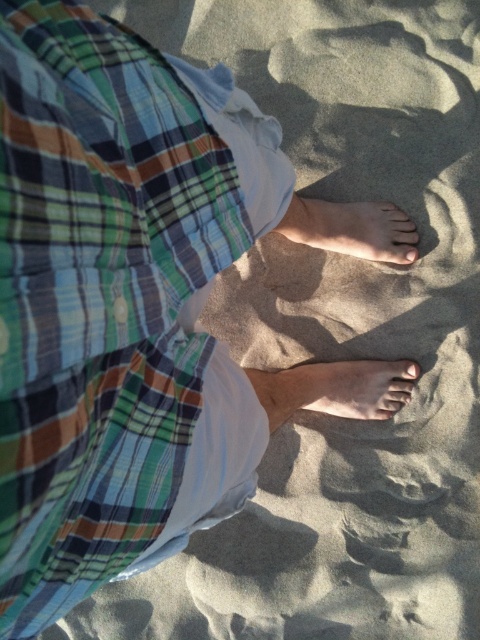
Describe the element at coordinates (349, 228) in the screenshot. I see `skinny white foot at center` at that location.

Can you confirm if skinny white foot at center is positioned below matte skin toe at center?

No.

Locate an element on the screen. The width and height of the screenshot is (480, 640). skinny white foot at center is located at coordinates (349, 228).

Between light brown skin at center and matte skin toe at center, which one is positioned higher?

matte skin toe at center is higher up.

Does light brown skin at center have a greater width compared to matte skin toe at center?

Yes.

Does point (372, 371) lie behind point (414, 252)?

That is True.

At what (x,y) coordinates should I click in order to perform the action: click on light brown skin at center. Please return your answer as a coordinate pair (x, y). The image size is (480, 640). Looking at the image, I should click on (343, 388).

Where is `light brown skin at center`? light brown skin at center is located at coordinates (343, 388).

Looking at this image, measure the distance from light brown skin at center to matte brown toe at center.

The distance of light brown skin at center from matte brown toe at center is 8.23 inches.

From the picture: Who is more distant from viewer, (386, 412) or (411, 368)?

The point (386, 412) is more distant.

Locate an element on the screen. The image size is (480, 640). light brown skin at center is located at coordinates (343, 388).